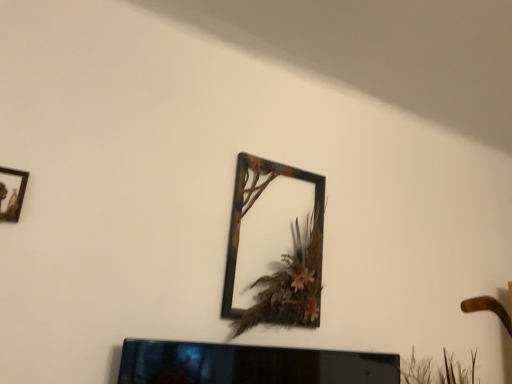
Find the location of a particular element. This screenshot has width=512, height=384. metallic frame at upper center, the first picture frame viewed from the right is located at coordinates (240, 230).

What do you see at coordinates (240, 230) in the screenshot? I see `metallic frame at upper center, which is the second picture frame in front-to-back order` at bounding box center [240, 230].

I want to click on wooden frame at upper left, which is the first picture frame from front to back, so click(x=12, y=193).

The height and width of the screenshot is (384, 512). I want to click on metallic frame at upper center, which is the second picture frame in front-to-back order, so click(x=240, y=230).

From the image's perspective, between wooden frame at upper left, which is the first picture frame from front to back, and metallic frame at upper center, the 2th picture frame in the left-to-right sequence, which one is located above?

wooden frame at upper left, which is the first picture frame from front to back, from the image's perspective.

Where is `picture frame in front of the metallic frame at upper center, the 1th picture frame in the back-to-front sequence`? picture frame in front of the metallic frame at upper center, the 1th picture frame in the back-to-front sequence is located at coordinates (12, 193).

Can you tell me how much wooden frame at upper left, which is the first picture frame from front to back, and metallic frame at upper center, the 2th picture frame in the left-to-right sequence, differ in facing direction?

There is a 2.04-degree angle between the facing directions of wooden frame at upper left, which is the first picture frame from front to back, and metallic frame at upper center, the 2th picture frame in the left-to-right sequence.

Can you tell me how much wooden frame at upper left, positioned as the 2th picture frame in right-to-left order, and black glossy tv at lower center differ in facing direction?

There is a 1.52-degree angle between the facing directions of wooden frame at upper left, positioned as the 2th picture frame in right-to-left order, and black glossy tv at lower center.

Is wooden frame at upper left, positioned as the 2th picture frame in right-to-left order, far from black glossy tv at lower center?

No, there isn't a large distance between wooden frame at upper left, positioned as the 2th picture frame in right-to-left order, and black glossy tv at lower center.

Is wooden frame at upper left, arranged as the second picture frame when viewed from the back, outside of black glossy tv at lower center?

That's correct, wooden frame at upper left, arranged as the second picture frame when viewed from the back, is outside of black glossy tv at lower center.

Considering the sizes of objects wooden frame at upper left, which is the first picture frame from front to back, and black glossy tv at lower center in the image provided, who is bigger, wooden frame at upper left, which is the first picture frame from front to back, or black glossy tv at lower center?

black glossy tv at lower center is bigger.

From a real-world perspective, is metallic frame at upper center, which is the second picture frame in front-to-back order, over wooden frame at upper left, arranged as the second picture frame when viewed from the back?

Yes, from a real-world perspective, metallic frame at upper center, which is the second picture frame in front-to-back order, is above wooden frame at upper left, arranged as the second picture frame when viewed from the back.

Does metallic frame at upper center, the first picture frame viewed from the right, have a lesser height compared to wooden frame at upper left, which is the first picture frame from front to back?

No, metallic frame at upper center, the first picture frame viewed from the right, is not shorter than wooden frame at upper left, which is the first picture frame from front to back.

Looking at this image, can you confirm if metallic frame at upper center, the 1th picture frame in the back-to-front sequence, is bigger than wooden frame at upper left, the 1th picture frame from the left?

Yes.

Is the surface of metallic frame at upper center, the first picture frame viewed from the right, in direct contact with wooden frame at upper left, the 1th picture frame from the left?

metallic frame at upper center, the first picture frame viewed from the right, is not next to wooden frame at upper left, the 1th picture frame from the left, and they're not touching.

Does black glossy tv at lower center turn towards wooden frame at upper left, the 1th picture frame from the left?

No, black glossy tv at lower center does not turn towards wooden frame at upper left, the 1th picture frame from the left.

From a real-world perspective, which object rests below the other?

In real-world perspective, black glossy tv at lower center is lower.

From the image's perspective, between black glossy tv at lower center and wooden frame at upper left, which is the first picture frame from front to back, who is located below?

black glossy tv at lower center, from the image's perspective.

Considering the positions of objects black glossy tv at lower center and wooden frame at upper left, the 1th picture frame from the left, in the image provided, who is in front, black glossy tv at lower center or wooden frame at upper left, the 1th picture frame from the left,?

wooden frame at upper left, the 1th picture frame from the left, is in front.

Can you tell me how much metallic frame at upper center, the 2th picture frame in the left-to-right sequence, and black glossy tv at lower center differ in facing direction?

There is a 0.52-degree angle between the facing directions of metallic frame at upper center, the 2th picture frame in the left-to-right sequence, and black glossy tv at lower center.

From the image's perspective, which one is positioned lower, metallic frame at upper center, the first picture frame viewed from the right, or black glossy tv at lower center?

black glossy tv at lower center, from the image's perspective.

Is point (227, 296) less distant than point (163, 360)?

No, it is behind (163, 360).

Is metallic frame at upper center, which is the second picture frame in front-to-back order, positioned with its back to black glossy tv at lower center?

metallic frame at upper center, which is the second picture frame in front-to-back order, does not have its back to black glossy tv at lower center.

Between point (343, 367) and point (243, 174), which one is positioned behind?

The point (243, 174) is farther.

Is black glossy tv at lower center thinner than metallic frame at upper center, the 1th picture frame in the back-to-front sequence?

Correct, the width of black glossy tv at lower center is less than that of metallic frame at upper center, the 1th picture frame in the back-to-front sequence.

Is black glossy tv at lower center further to the viewer compared to metallic frame at upper center, the 1th picture frame in the back-to-front sequence?

No, it is in front of metallic frame at upper center, the 1th picture frame in the back-to-front sequence.

Does black glossy tv at lower center touch metallic frame at upper center, which is the second picture frame in front-to-back order?

No, black glossy tv at lower center is not with metallic frame at upper center, which is the second picture frame in front-to-back order.

Where is `picture frame that appears above the metallic frame at upper center, the 2th picture frame in the left-to-right sequence (from the image's perspective)`? picture frame that appears above the metallic frame at upper center, the 2th picture frame in the left-to-right sequence (from the image's perspective) is located at coordinates (12, 193).

Where is `television that appears below the wooden frame at upper left, arranged as the second picture frame when viewed from the back (from a real-world perspective)`? The image size is (512, 384). television that appears below the wooden frame at upper left, arranged as the second picture frame when viewed from the back (from a real-world perspective) is located at coordinates (250, 365).

From the image, which object appears to be farther from wooden frame at upper left, arranged as the second picture frame when viewed from the back, metallic frame at upper center, the 2th picture frame in the left-to-right sequence, or black glossy tv at lower center?

Based on the image, metallic frame at upper center, the 2th picture frame in the left-to-right sequence, appears to be further to wooden frame at upper left, arranged as the second picture frame when viewed from the back.

Looking at the image, which one is located further to wooden frame at upper left, positioned as the 2th picture frame in right-to-left order, black glossy tv at lower center or metallic frame at upper center, the 1th picture frame in the back-to-front sequence?

metallic frame at upper center, the 1th picture frame in the back-to-front sequence, is further to wooden frame at upper left, positioned as the 2th picture frame in right-to-left order.

Estimate the real-world distances between objects in this image. Which object is closer to metallic frame at upper center, the 2th picture frame in the left-to-right sequence, wooden frame at upper left, positioned as the 2th picture frame in right-to-left order, or black glossy tv at lower center?

black glossy tv at lower center is closer to metallic frame at upper center, the 2th picture frame in the left-to-right sequence.

When comparing their distances from black glossy tv at lower center, does metallic frame at upper center, the 2th picture frame in the left-to-right sequence, or wooden frame at upper left, arranged as the second picture frame when viewed from the back, seem closer?

Based on the image, metallic frame at upper center, the 2th picture frame in the left-to-right sequence, appears to be nearer to black glossy tv at lower center.

From the image, which object appears to be farther from black glossy tv at lower center, wooden frame at upper left, the 1th picture frame from the left, or metallic frame at upper center, which is the second picture frame in front-to-back order?

wooden frame at upper left, the 1th picture frame from the left, lies further to black glossy tv at lower center than the other object.

From the picture: Considering their positions, is black glossy tv at lower center positioned closer to metallic frame at upper center, the 2th picture frame in the left-to-right sequence, than wooden frame at upper left, which is the first picture frame from front to back?

Among the two, black glossy tv at lower center is located nearer to metallic frame at upper center, the 2th picture frame in the left-to-right sequence.

Identify the location of television between wooden frame at upper left, which is the first picture frame from front to back, and metallic frame at upper center, the first picture frame viewed from the right, in the horizontal direction. (250, 365).